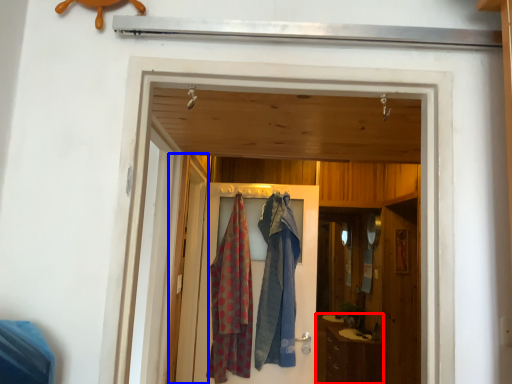
Question: Which of the following is the closest to the observer, cabinetry (highlighted by a red box) or screen door (highlighted by a blue box)?

Choices:
 (A) cabinetry
 (B) screen door

Answer: (B)